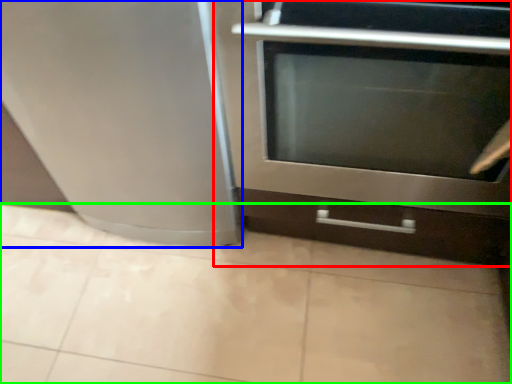
Question: Considering the real-world distances, which object is farthest from oven (highlighted by a red box)? appliance (highlighted by a blue box) or ceramic tile (highlighted by a green box)?

Choices:
 (A) appliance
 (B) ceramic tile

Answer: (B)